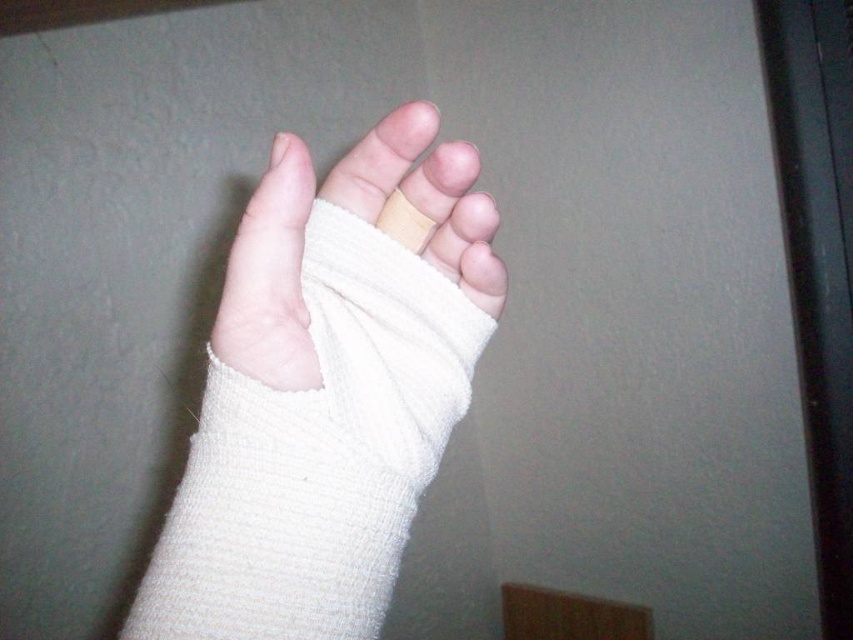
Question: Can you confirm if white textured bandage at center is bigger than white bandage at center?

Choices:
 (A) no
 (B) yes

Answer: (B)

Question: Observing the image, what is the correct spatial positioning of white textured bandage at center in reference to white bandage at center?

Choices:
 (A) above
 (B) below

Answer: (B)

Question: Which object appears farthest from the camera in this image?

Choices:
 (A) white textured bandage at center
 (B) white bandage at center

Answer: (B)

Question: Can you confirm if white textured bandage at center is smaller than white bandage at center?

Choices:
 (A) yes
 (B) no

Answer: (B)

Question: Which point is closer to the camera?

Choices:
 (A) white textured bandage at center
 (B) white bandage at center

Answer: (A)